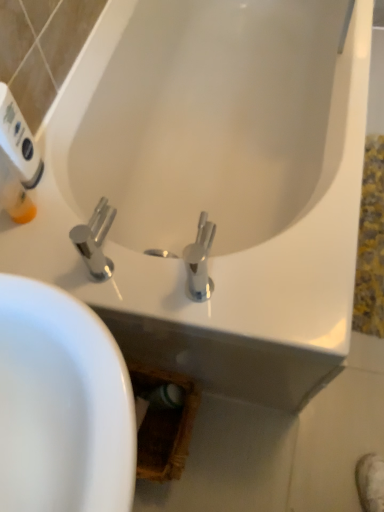
Where is `vacant space positioned to the left of polished chrome faucet at center`? This screenshot has height=512, width=384. vacant space positioned to the left of polished chrome faucet at center is located at coordinates (49, 256).